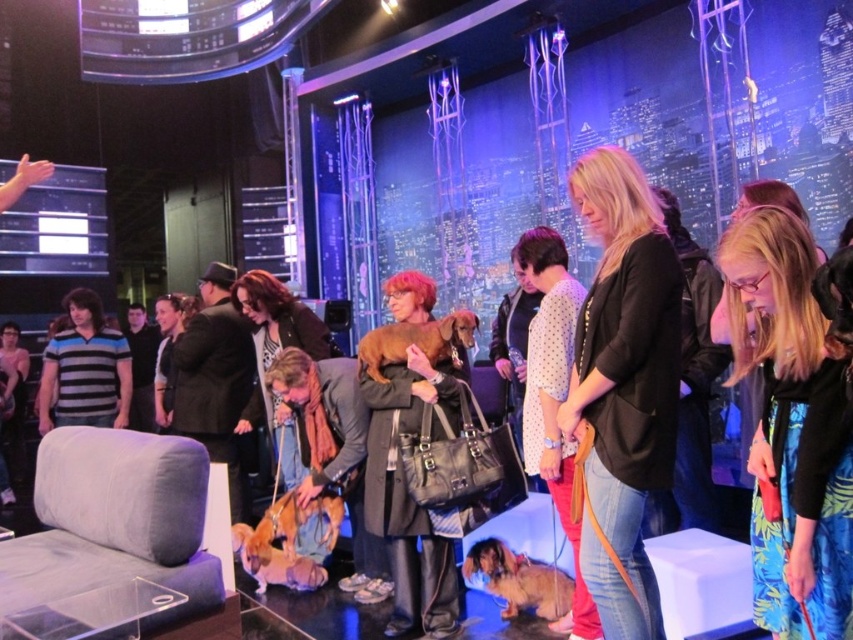
You are a photographer standing in the studio and need to capture both the blue floral skirt at lower right and the brown fur dog at center in a single frame. Which object should you focus on first to ensure both are in the frame without moving the camera?

The blue floral skirt at lower right is larger than the brown fur dog at center, so focusing on the larger blue floral skirt at lower right first will help ensure both are included in the frame.

You are a photographer setting up a shoot in the studio. You need to position a backdrop stand that is 1.2 meters tall. The backdrop stand must be placed behind both the matte brown coat at center and the brown fur dog at center. Considering their heights, will the backdrop stand be tall enough to cover both?

The matte brown coat at center has a greater height compared to the brown fur dog at center. Since the backdrop stand is 1.2 meters tall, it will be tall enough to cover both objects as long as the tallest object, the matte brown coat at center, is shorter than 1.2 meters. However, without knowing the exact height of the coat, we can only confirm the stand is taller than the dog.

You are standing in the studio and want to place a new decorative item between the two points, point (402,497) and point (163,404). To ensure it is visible to the audience, which point should the item be closer to?

The decorative item should be placed closer to point (402,497) because it is closer to the viewer, making it more visible to the audience.